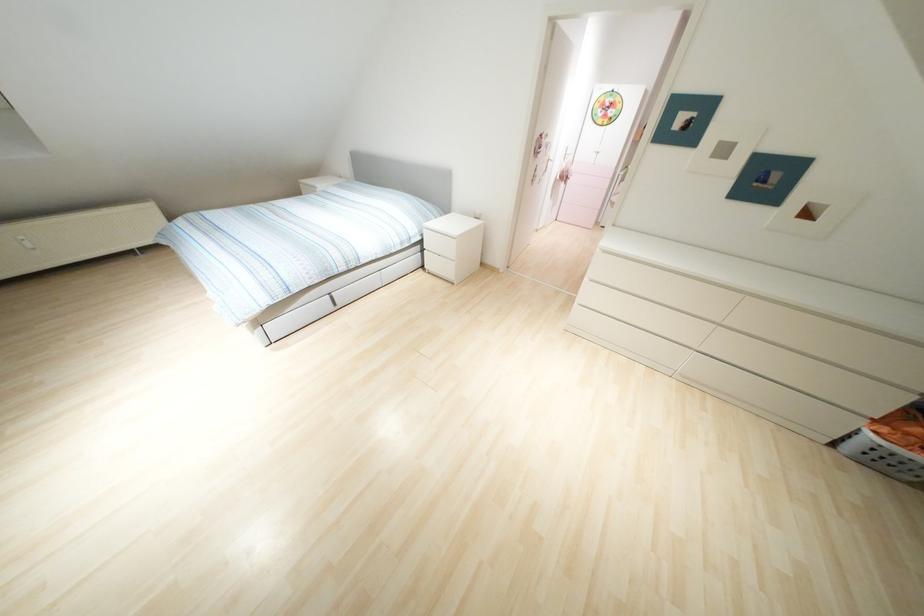
The width and height of the screenshot is (924, 616). What do you see at coordinates (25, 241) in the screenshot?
I see `the radiator knob` at bounding box center [25, 241].